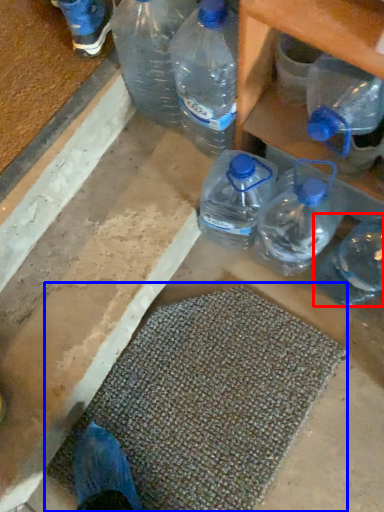
Question: Which of the following is the farthest to the observer, bottle (highlighted by a red box) or bath mat (highlighted by a blue box)?

Choices:
 (A) bottle
 (B) bath mat

Answer: (B)